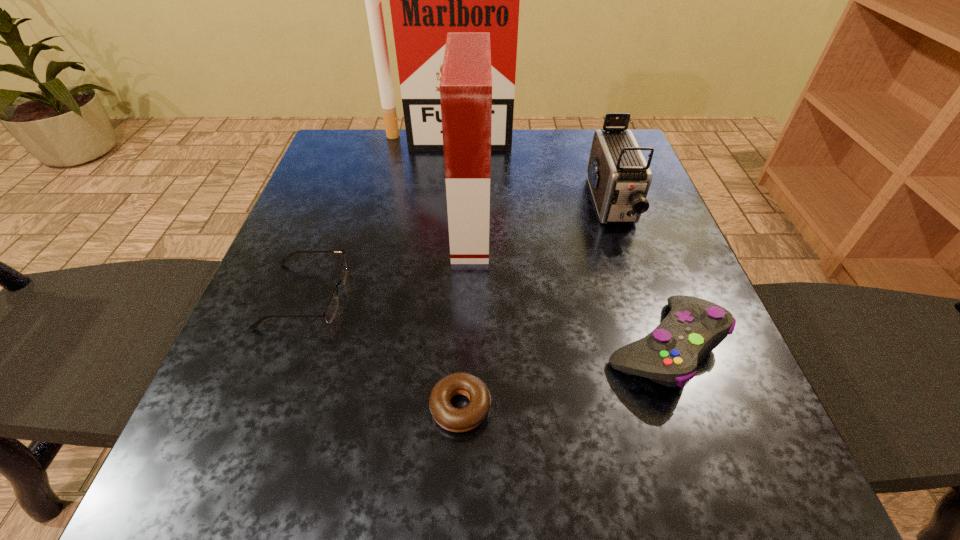
This screenshot has width=960, height=540. Find the location of `vacant point located on the front-facing side of the spectacles`. vacant point located on the front-facing side of the spectacles is located at coordinates (478, 295).

This screenshot has width=960, height=540. What are the coordinates of `vacant space located 0.310m on the right of the doughnut` in the screenshot? It's located at (713, 407).

I want to click on cigarette case that is positioned at the far edge, so click(427, 0).

At what (x,y) coordinates should I click in order to perform the action: click on camcorder that is positioned at the far edge. Please return your answer as a coordinate pair (x, y). Looking at the image, I should click on (619, 177).

The image size is (960, 540). What are the coordinates of `cigarette case that is at the left edge` in the screenshot? It's located at (427, 0).

Identify the location of spectacles at the left edge. (331, 309).

Locate an element on the screen. The height and width of the screenshot is (540, 960). camcorder located in the right edge section of the desktop is located at coordinates (619, 177).

The width and height of the screenshot is (960, 540). What are the coordinates of `control that is at the right edge` in the screenshot? It's located at (669, 355).

This screenshot has width=960, height=540. Identify the location of object located in the far left corner section of the desktop. (427, 0).

Find the location of a particular element. object at the far right corner is located at coordinates (619, 177).